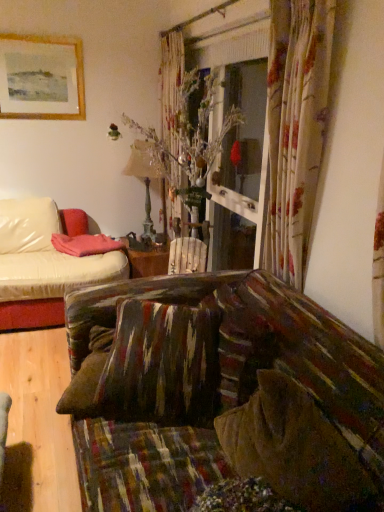
At what (x,y) coordinates should I click in order to perform the action: click on textured brown pillow at center. Please return your answer as a coordinate pair (x, y). Looking at the image, I should click on (161, 365).

Image resolution: width=384 pixels, height=512 pixels. What do you see at coordinates (161, 365) in the screenshot? I see `textured brown pillow at center` at bounding box center [161, 365].

In order to face gold-framed painting at upper left, should I rotate leftwards or rightwards?

A 19.509 degree turn to the left will do.

The image size is (384, 512). I want to click on gold-framed painting at upper left, so click(41, 78).

Based on the photo, measure the distance between point (x=66, y=52) and camera.

Point (x=66, y=52) is 3.50 meters from camera.

This screenshot has height=512, width=384. What do you see at coordinates (41, 78) in the screenshot? I see `gold-framed painting at upper left` at bounding box center [41, 78].

The height and width of the screenshot is (512, 384). What are the coordinates of `textured brown pillow at center` in the screenshot? It's located at (161, 365).

Can you confirm if textured brown pillow at center is positioned to the right of gold-framed painting at upper left?

Yes, textured brown pillow at center is to the right of gold-framed painting at upper left.

Is textured brown pillow at center behind gold-framed painting at upper left?

No.

Is point (145, 311) closer or farther from the camera than point (20, 50)?

Point (145, 311) appears to be closer to the viewer than point (20, 50).

From the image's perspective, is textured brown pillow at center above or below gold-framed painting at upper left?

textured brown pillow at center is situated lower than gold-framed painting at upper left in the image.

From a real-world perspective, who is located higher, textured brown pillow at center or gold-framed painting at upper left?

In real-world perspective, gold-framed painting at upper left is above.

From the picture: Which object is wider, textured brown pillow at center or gold-framed painting at upper left?

textured brown pillow at center is wider.

Does textured brown pillow at center have a lesser height compared to gold-framed painting at upper left?

No.

Can you confirm if textured brown pillow at center is bigger than gold-framed painting at upper left?

Indeed, textured brown pillow at center has a larger size compared to gold-framed painting at upper left.

Is gold-framed painting at upper left completely or partially inside textured brown pillow at center?

Definitely not — gold-framed painting at upper left is not inside textured brown pillow at center.

Is textured brown pillow at center directly adjacent to gold-framed painting at upper left?

No, textured brown pillow at center is not touching gold-framed painting at upper left.

Is textured brown pillow at center looking in the opposite direction of gold-framed painting at upper left?

No, textured brown pillow at center is not facing away from gold-framed painting at upper left.

How distant is textured brown pillow at center from gold-framed painting at upper left?

textured brown pillow at center and gold-framed painting at upper left are 8.65 feet apart.

Image resolution: width=384 pixels, height=512 pixels. Identify the location of picture frame lying above the textured brown pillow at center (from the image's perspective). (41, 78).

Can you confirm if gold-framed painting at upper left is positioned to the left of textured brown pillow at center?

Yes.

Based on the photo, considering their positions, is gold-framed painting at upper left located in front of or behind textured brown pillow at center?

Visually, gold-framed painting at upper left is located behind textured brown pillow at center.

Which is in front, point (40, 38) or point (151, 309)?

The point (151, 309) is closer.

From the image's perspective, which is below, gold-framed painting at upper left or textured brown pillow at center?

From the image's view, textured brown pillow at center is below.

From a real-world perspective, who is located lower, gold-framed painting at upper left or textured brown pillow at center?

textured brown pillow at center.

Considering the relative sizes of gold-framed painting at upper left and textured brown pillow at center in the image provided, is gold-framed painting at upper left wider than textured brown pillow at center?

In fact, gold-framed painting at upper left might be narrower than textured brown pillow at center.

Considering the sizes of gold-framed painting at upper left and textured brown pillow at center in the image, is gold-framed painting at upper left taller or shorter than textured brown pillow at center?

gold-framed painting at upper left is shorter than textured brown pillow at center.

Considering the sizes of gold-framed painting at upper left and textured brown pillow at center in the image, is gold-framed painting at upper left bigger or smaller than textured brown pillow at center?

gold-framed painting at upper left is smaller than textured brown pillow at center.

Is gold-framed painting at upper left located outside textured brown pillow at center?

Absolutely, gold-framed painting at upper left is external to textured brown pillow at center.

Are gold-framed painting at upper left and textured brown pillow at center located far from each other?

Indeed, gold-framed painting at upper left is not near textured brown pillow at center.

Is gold-framed painting at upper left aimed at textured brown pillow at center?

Yes, gold-framed painting at upper left faces towards textured brown pillow at center.

Identify the location of pillow that is below the gold-framed painting at upper left (from the image's perspective). (161, 365).

Locate an element on the screen. The height and width of the screenshot is (512, 384). pillow located underneath the gold-framed painting at upper left (from a real-world perspective) is located at coordinates (161, 365).

This screenshot has width=384, height=512. I want to click on pillow that is in front of the gold-framed painting at upper left, so click(x=161, y=365).